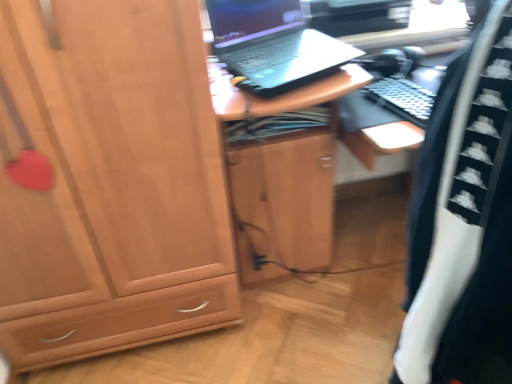
Question: Is black/white fabric at right in front of or behind matte wood cabinet at left in the image?

Choices:
 (A) front
 (B) behind

Answer: (A)

Question: Choose the correct answer: Is black/white fabric at right inside matte wood cabinet at left or outside it?

Choices:
 (A) inside
 (B) outside

Answer: (B)

Question: Considering the real-world distances, which object is farthest from the matte wood cabinet at left?

Choices:
 (A) black matte laptop at upper center
 (B) black/white fabric at right

Answer: (B)

Question: Which is farther from the black matte laptop at upper center?

Choices:
 (A) matte wood cabinet at left
 (B) black/white fabric at right

Answer: (B)